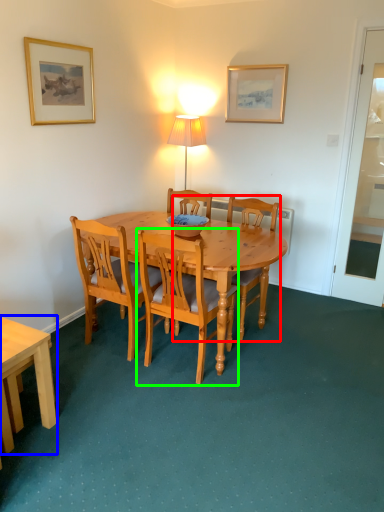
Question: Which is nearer to the chair (highlighted by a red box)? desk (highlighted by a blue box) or chair (highlighted by a green box).

Choices:
 (A) desk
 (B) chair

Answer: (B)